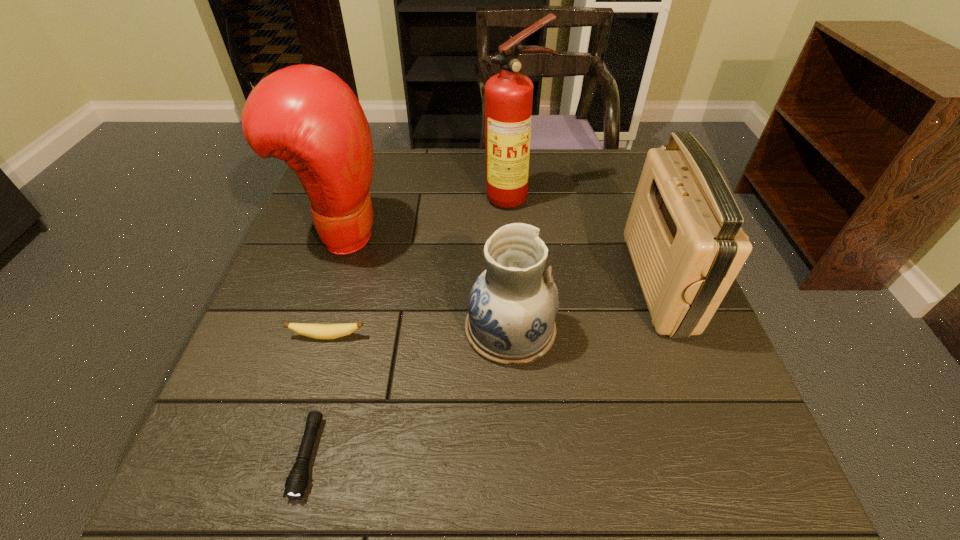
In order to click on vacant point located between the shortest object and the fire extinguisher in this screenshot , I will do `click(411, 327)`.

Find the location of a particular element. free space between the second shortest object and the third shortest object is located at coordinates (419, 333).

You are a GUI agent. You are given a task and a screenshot of the screen. Output one action in this format:
    pyautogui.click(x=<x>, y=<y>)
    Task: Click on the vacant area that lies between the banana and the boxing glove
    This screenshot has height=540, width=960.
    Given the screenshot: What is the action you would take?
    pyautogui.click(x=335, y=285)

Find the location of a particular element. Image resolution: width=960 pixels, height=540 pixels. blank region between the banana and the boxing glove is located at coordinates point(335,285).

Locate an element on the screen. free space between the fifth tallest object and the shortest object is located at coordinates (318, 396).

Locate which object ranks fourth in proximity to the radio receiver. Please provide its 2D coordinates. Your answer should be formatted as a tuple, i.e. [(x, y)], where the tuple contains the x and y coordinates of a point satisfying the conditions above.

[(317, 331)]

Identify which object is the second nearest to the fifth tallest object. Please provide its 2D coordinates. Your answer should be formatted as a tuple, i.e. [(x, y)], where the tuple contains the x and y coordinates of a point satisfying the conditions above.

[(307, 116)]

This screenshot has width=960, height=540. Identify the location of blank area in the image that satisfies the following two spatial constraints: 1. on the striking surface of the boxing glove; 2. on the left side of the second shortest object. (307, 336).

The width and height of the screenshot is (960, 540). I want to click on blank area in the image that satisfies the following two spatial constraints: 1. on the front-facing side of the rightmost object; 2. at the lens end of the nearest object, so click(725, 457).

The width and height of the screenshot is (960, 540). Identify the location of vacant position in the image that satisfies the following two spatial constraints: 1. on the striking surface of the fifth tallest object; 2. on the right side of the boxing glove. (307, 336).